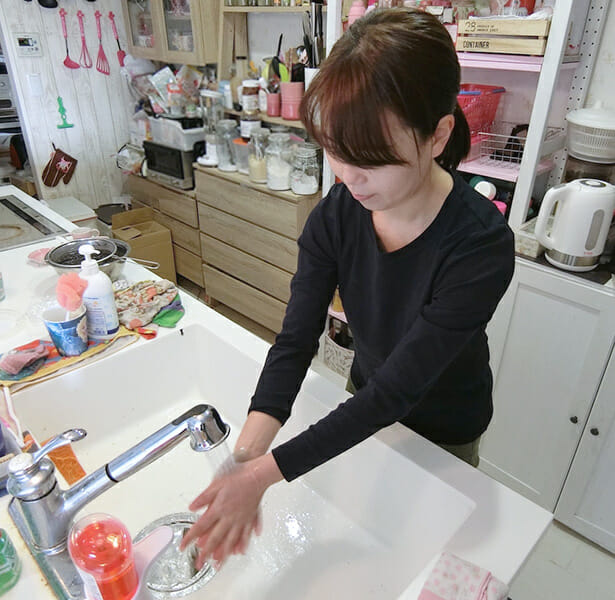
Where is `floor`? Image resolution: width=615 pixels, height=600 pixels. floor is located at coordinates (573, 570).